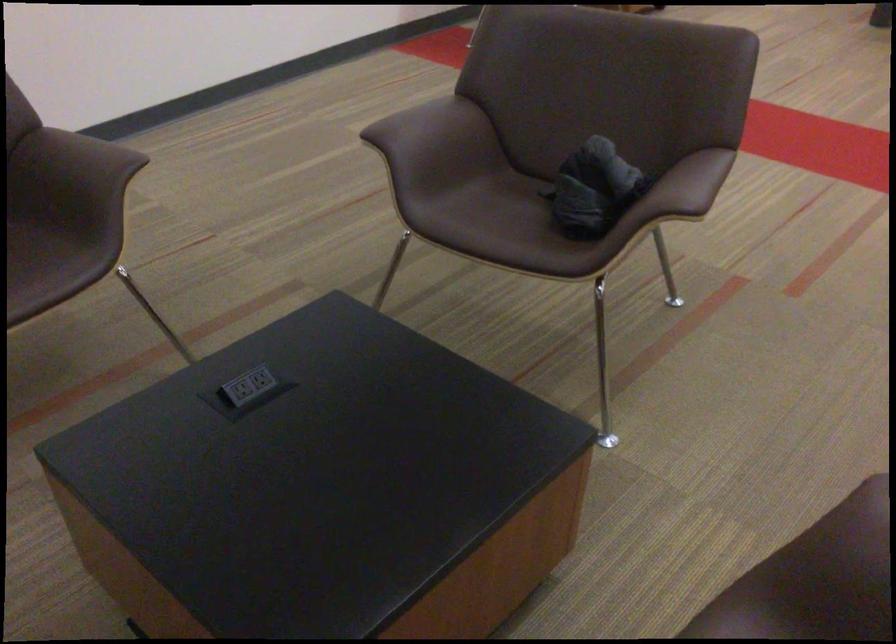
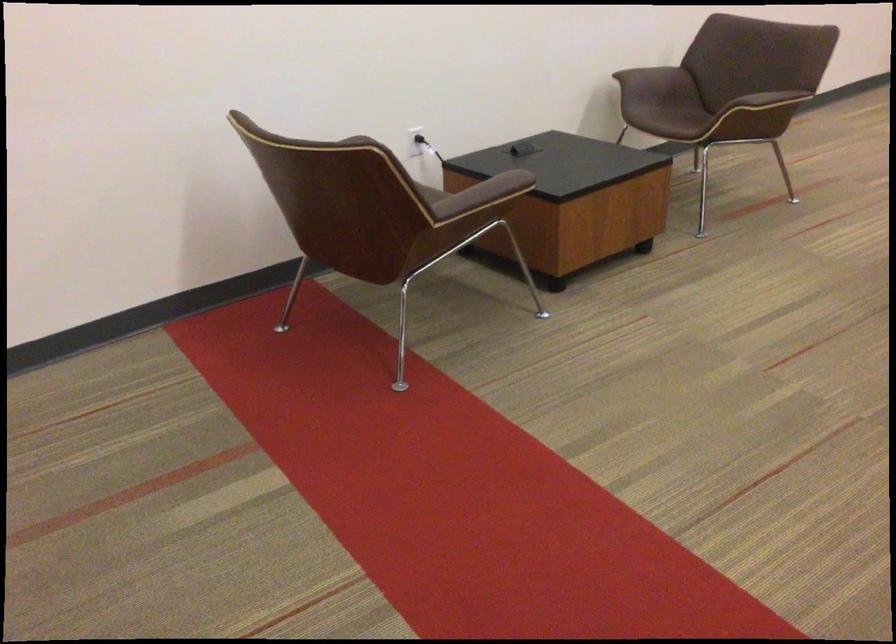
In a continuous first-person perspective shot, in which direction is the camera moving?

The cameraman moved toward right, forward.